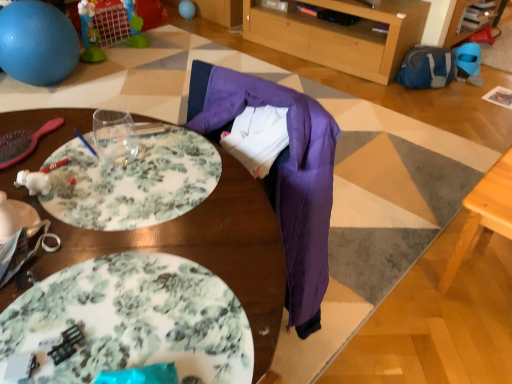
What do you see at coordinates (16, 218) in the screenshot? The height and width of the screenshot is (384, 512). I see `white glossy plate at lower left, the 1th plate in the top-to-bottom sequence` at bounding box center [16, 218].

What do you see at coordinates (176, 231) in the screenshot?
I see `wooden table at center, which is counted as the first table, starting from the left` at bounding box center [176, 231].

What is the approximate width of wooden table at center, positioned as the 2th table in right-to-left order?

20.55 inches.

This screenshot has width=512, height=384. What are the coordinates of `floral ceramic plate at lower left, which ranks as the 2th plate in left-to-right order` in the screenshot? It's located at (132, 320).

Considering the positions of point (23, 209) and point (189, 246), is point (23, 209) closer or farther from the camera than point (189, 246)?

Point (23, 209) is farther from the camera than point (189, 246).

Where is `plate located above the wooden table at center, which is counted as the first table, starting from the left (from the image's perspective)`? Image resolution: width=512 pixels, height=384 pixels. plate located above the wooden table at center, which is counted as the first table, starting from the left (from the image's perspective) is located at coordinates (16, 218).

How far apart are white glossy plate at lower left, marked as the second plate in a bottom-to-top arrangement, and wooden table at center, which is counted as the first table, starting from the left?

white glossy plate at lower left, marked as the second plate in a bottom-to-top arrangement, and wooden table at center, which is counted as the first table, starting from the left, are 9.58 inches apart from each other.

From a real-world perspective, between white glossy plate at lower left, which is counted as the second plate, starting from the right, and wooden table at center, positioned as the 2th table in right-to-left order, who is vertically lower?

wooden table at center, positioned as the 2th table in right-to-left order, is physically lower.

Is matte blue balloon at upper center far away from wooden table at center, which is counted as the first table, starting from the left?

Yes.

Based on their positions, is matte blue balloon at upper center located to the left or right of wooden table at center, which is counted as the first table, starting from the left?

matte blue balloon at upper center is positioned on wooden table at center, which is counted as the first table, starting from the left,'s left side.

Which object is closer to the camera, matte blue balloon at upper center or wooden table at center, positioned as the 2th table in right-to-left order?

wooden table at center, positioned as the 2th table in right-to-left order, is closer to the camera.

Looking at this image, is matte blue balloon at upper center facing towards wooden table at center, positioned as the 2th table in right-to-left order?

No.

How many degrees apart are the facing directions of blue rubber ball at upper left and floral ceramic plate at lower left, which ranks as the 2th plate in left-to-right order?

The angular difference between blue rubber ball at upper left and floral ceramic plate at lower left, which ranks as the 2th plate in left-to-right order, is 175 degrees.

Is blue rubber ball at upper left with floral ceramic plate at lower left, which ranks as the 2th plate in left-to-right order?

No, blue rubber ball at upper left is not beside floral ceramic plate at lower left, which ranks as the 2th plate in left-to-right order.

Is blue rubber ball at upper left at the left side of floral ceramic plate at lower left, marked as the 1th plate in a bottom-to-top arrangement?

Correct, you'll find blue rubber ball at upper left to the left of floral ceramic plate at lower left, marked as the 1th plate in a bottom-to-top arrangement.

From a real-world perspective, which object rests below the other?

In real-world perspective, blue rubber ball at upper left is lower.

Is blue rubber ball at upper left not close to wooden table at center, positioned as the 2th table in right-to-left order?

Yes, blue rubber ball at upper left and wooden table at center, positioned as the 2th table in right-to-left order, are quite far apart.

Does blue rubber ball at upper left turn towards wooden table at center, which is counted as the first table, starting from the left?

Yes, blue rubber ball at upper left is turned towards wooden table at center, which is counted as the first table, starting from the left.

Is blue rubber ball at upper left positioned behind wooden table at center, positioned as the 2th table in right-to-left order?

Yes, it is.

In terms of size, does blue rubber ball at upper left appear bigger or smaller than wooden table at center, which is counted as the first table, starting from the left?

Considering their sizes, blue rubber ball at upper left takes up less space than wooden table at center, which is counted as the first table, starting from the left.

The image size is (512, 384). Identify the location of table above the light wood table at lower right, the 1th table viewed from the right (from a real-world perspective). (176, 231).

From a real-world perspective, is light wood table at lower right, marked as the 2th table in a left-to-right arrangement, located higher than wooden table at center, positioned as the 2th table in right-to-left order?

Incorrect, from a real-world perspective, light wood table at lower right, marked as the 2th table in a left-to-right arrangement, is lower than wooden table at center, positioned as the 2th table in right-to-left order.

From the picture: Who is shorter, light wood table at lower right, the 1th table viewed from the right, or wooden table at center, which is counted as the first table, starting from the left?

With less height is light wood table at lower right, the 1th table viewed from the right.

Does point (483, 226) lie in front of point (170, 251)?

That is False.

Between light wood table at lower right, marked as the 2th table in a left-to-right arrangement, and blue rubber ball at upper left, which one has more height?

Standing taller between the two is blue rubber ball at upper left.

Considering the positions of objects light wood table at lower right, marked as the 2th table in a left-to-right arrangement, and blue rubber ball at upper left in the image provided, who is in front, light wood table at lower right, marked as the 2th table in a left-to-right arrangement, or blue rubber ball at upper left?

light wood table at lower right, marked as the 2th table in a left-to-right arrangement, is more forward.

Which of these two, light wood table at lower right, the 1th table viewed from the right, or blue rubber ball at upper left, is wider?

blue rubber ball at upper left is wider.

Consider the image. From the image's perspective, which object appears higher, light wood table at lower right, the 1th table viewed from the right, or blue rubber ball at upper left?

From the image's view, blue rubber ball at upper left is above.

Are wooden table at center, which is counted as the first table, starting from the left, and blue rubber ball at upper left far apart?

Yes.

At what (x,y) coordinates should I click in order to perform the action: click on table that appears above the blue rubber ball at upper left (from a real-world perspective). Please return your answer as a coordinate pair (x, y). This screenshot has width=512, height=384. Looking at the image, I should click on (176, 231).

Is blue rubber ball at upper left at the back of wooden table at center, positioned as the 2th table in right-to-left order?

No, blue rubber ball at upper left is not at the back of wooden table at center, positioned as the 2th table in right-to-left order.

Based on their sizes in the image, would you say wooden table at center, which is counted as the first table, starting from the left, is bigger or smaller than blue rubber ball at upper left?

wooden table at center, which is counted as the first table, starting from the left, is bigger than blue rubber ball at upper left.

From the wooden table at center, positioned as the 2th table in right-to-left order, count the 2nd plate to the left and point to it. Please provide its 2D coordinates.

[(16, 218)]

Image resolution: width=512 pixels, height=384 pixels. Find the location of `table that is the 2nd one above the matte blue balloon at upper center (from a real-world perspective)`. table that is the 2nd one above the matte blue balloon at upper center (from a real-world perspective) is located at coordinates (176, 231).

In the scene shown: Which object lies further to the anchor point floral ceramic plate at lower left, marked as the 1th plate in a bottom-to-top arrangement, white glossy plate at lower left, placed as the 1th plate when sorted from left to right, or wooden table at center, positioned as the 2th table in right-to-left order?

white glossy plate at lower left, placed as the 1th plate when sorted from left to right, lies further to floral ceramic plate at lower left, marked as the 1th plate in a bottom-to-top arrangement, than the other object.

Which object lies further to the anchor point floral ceramic plate at lower left, marked as the 1th plate in a bottom-to-top arrangement, wooden table at center, which is counted as the first table, starting from the left, or blue rubber ball at upper left?

Based on the image, blue rubber ball at upper left appears to be further to floral ceramic plate at lower left, marked as the 1th plate in a bottom-to-top arrangement.

From the picture: Which object lies further to the anchor point light wood table at lower right, the 1th table viewed from the right, white glossy plate at lower left, which is counted as the second plate, starting from the right, or floral ceramic plate at lower left, marked as the 1th plate in a bottom-to-top arrangement?

white glossy plate at lower left, which is counted as the second plate, starting from the right, is further to light wood table at lower right, the 1th table viewed from the right.

From the image, which object appears to be nearer to matte blue balloon at upper center, white glossy plate at lower left, placed as the 1th plate when sorted from left to right, or wooden table at center, positioned as the 2th table in right-to-left order?

Based on the image, wooden table at center, positioned as the 2th table in right-to-left order, appears to be nearer to matte blue balloon at upper center.

From the picture: Considering their positions, is white glossy plate at lower left, placed as the 1th plate when sorted from left to right, positioned further to light wood table at lower right, the 1th table viewed from the right, than matte blue balloon at upper center?

matte blue balloon at upper center.

From the image, which object appears to be nearer to matte blue balloon at upper center, wooden table at center, positioned as the 2th table in right-to-left order, or light wood table at lower right, the 1th table viewed from the right?

light wood table at lower right, the 1th table viewed from the right, is positioned closer to the anchor matte blue balloon at upper center.

When comparing their distances from floral ceramic plate at lower left, the 2th plate viewed from the top, does blue rubber ball at upper left or matte blue balloon at upper center seem further?

Based on the image, matte blue balloon at upper center appears to be further to floral ceramic plate at lower left, the 2th plate viewed from the top.

From the image, which object appears to be nearer to floral ceramic plate at lower left, which ranks as the 2th plate in left-to-right order, white glossy plate at lower left, placed as the 1th plate when sorted from left to right, or light wood table at lower right, marked as the 2th table in a left-to-right arrangement?

Based on the image, white glossy plate at lower left, placed as the 1th plate when sorted from left to right, appears to be nearer to floral ceramic plate at lower left, which ranks as the 2th plate in left-to-right order.

The width and height of the screenshot is (512, 384). I want to click on ball between wooden table at center, positioned as the 2th table in right-to-left order, and matte blue balloon at upper center from front to back, so click(37, 43).

Identify the location of plate positioned between wooden table at center, positioned as the 2th table in right-to-left order, and blue rubber ball at upper left from near to far. This screenshot has height=384, width=512. (16, 218).

Where is `ball between light wood table at lower right, marked as the 2th table in a left-to-right arrangement, and matte blue balloon at upper center in the front-back direction`? The width and height of the screenshot is (512, 384). ball between light wood table at lower right, marked as the 2th table in a left-to-right arrangement, and matte blue balloon at upper center in the front-back direction is located at coordinates (37, 43).

Where is `table between floral ceramic plate at lower left, marked as the 1th plate in a bottom-to-top arrangement, and white glossy plate at lower left, marked as the second plate in a bottom-to-top arrangement, from front to back`? Image resolution: width=512 pixels, height=384 pixels. table between floral ceramic plate at lower left, marked as the 1th plate in a bottom-to-top arrangement, and white glossy plate at lower left, marked as the second plate in a bottom-to-top arrangement, from front to back is located at coordinates (176, 231).